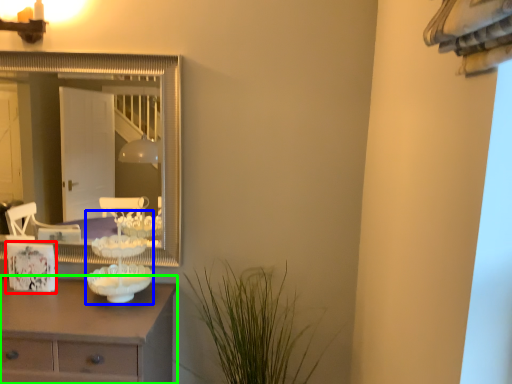
Question: Which is nearer to the picture frame (highlighted by a red box)? candle holder (highlighted by a blue box) or chest of drawers (highlighted by a green box).

Choices:
 (A) candle holder
 (B) chest of drawers

Answer: (A)